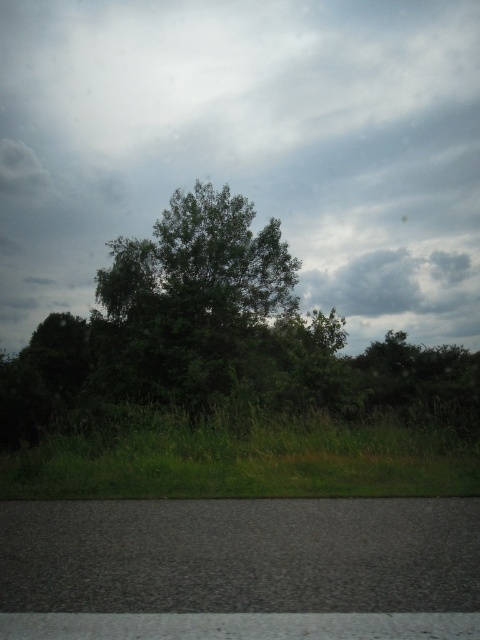
Which is more to the left, green leafy tree at center or green grass at lower center?

Positioned to the left is green grass at lower center.

Is point (264, 300) less distant than point (372, 484)?

That is False.

In order to click on green leafy tree at center in this screenshot , I will do `click(216, 333)`.

Who is higher up, cloudy sky at upper center or green grass at lower center?

cloudy sky at upper center is higher up.

Does point (336, 180) come in front of point (298, 426)?

No, it is behind (298, 426).

Does point (287, 52) come farther from viewer compared to point (227, 440)?

Yes, it is behind point (227, 440).

The height and width of the screenshot is (640, 480). Find the location of `cloudy sky at upper center`. cloudy sky at upper center is located at coordinates (248, 147).

Between cloudy sky at upper center and green leafy tree at center, which one appears on the left side from the viewer's perspective?

From the viewer's perspective, cloudy sky at upper center appears more on the left side.

Is point (302, 250) positioned before point (166, 385)?

That is False.

Where is `cloudy sky at upper center`? The image size is (480, 640). cloudy sky at upper center is located at coordinates (248, 147).